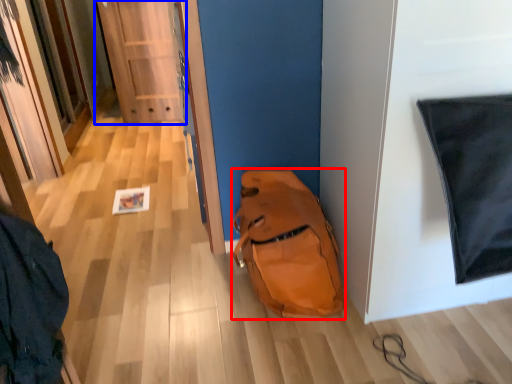
Question: Among these objects, which one is nearest to the camera, backpack (highlighted by a red box) or door (highlighted by a blue box)?

Choices:
 (A) backpack
 (B) door

Answer: (A)